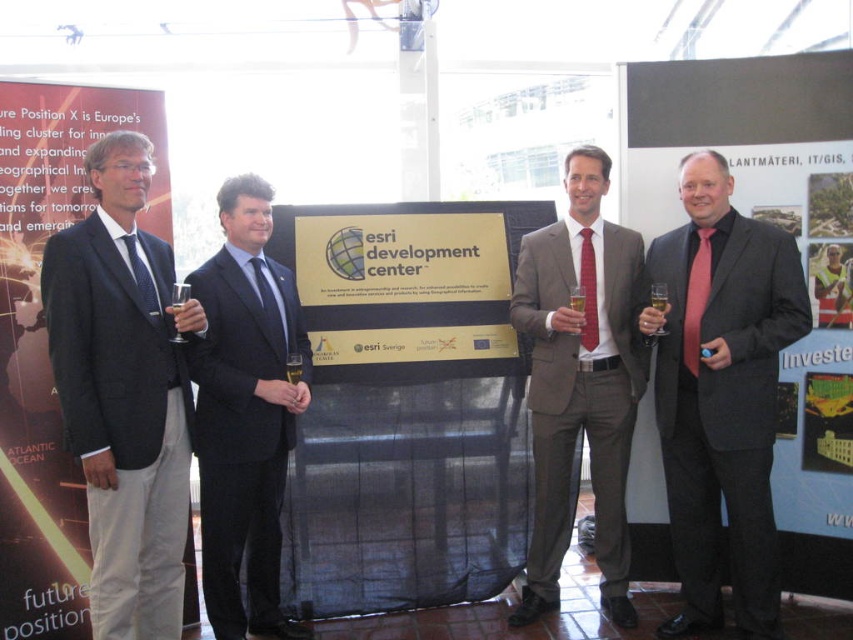
The height and width of the screenshot is (640, 853). What do you see at coordinates (125, 392) in the screenshot? I see `dark gray suit at left` at bounding box center [125, 392].

Which is in front, point (119, 340) or point (286, 369)?

Point (119, 340)

Identify the location of dark gray suit at left. (125, 392).

Does dark gray suit at left appear on the left side of matte gray suit at center?

Indeed, dark gray suit at left is positioned on the left side of matte gray suit at center.

Does point (70, 419) lie behind point (556, 397)?

No, it is not.

The width and height of the screenshot is (853, 640). In order to click on dark gray suit at left in this screenshot , I will do `click(125, 392)`.

Is matte black suit at right above dark blue suit at center?

Correct, matte black suit at right is located above dark blue suit at center.

Can you confirm if matte black suit at right is wider than dark blue suit at center?

Yes.

Identify the location of matte black suit at right. This screenshot has width=853, height=640. 721,394.